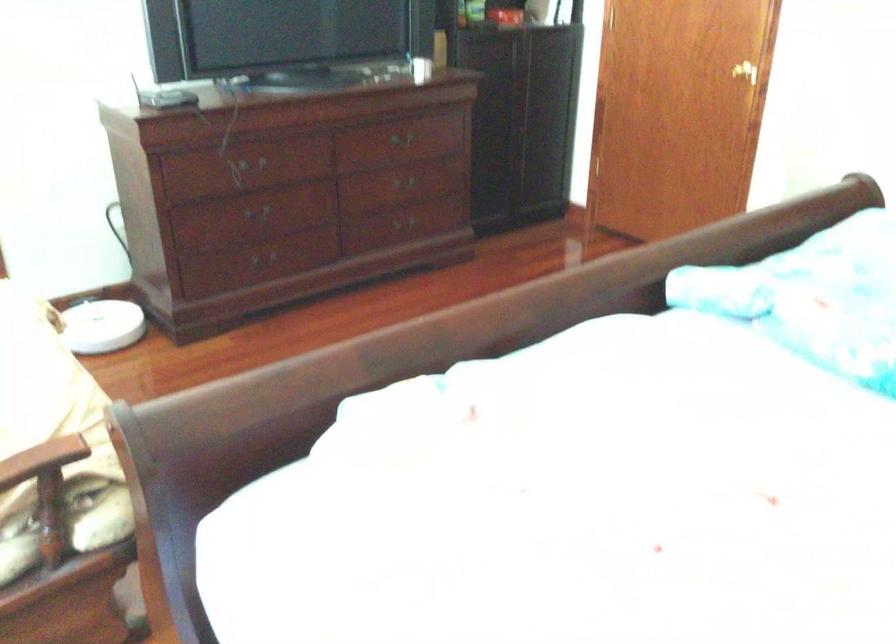
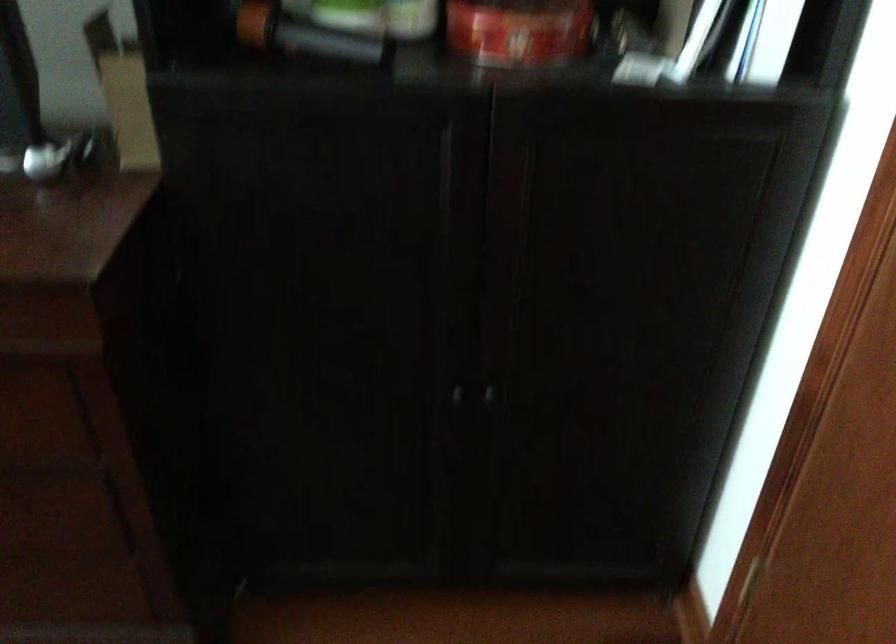
Find the pixel in the second image that matches [514,129] in the first image.

(457, 395)